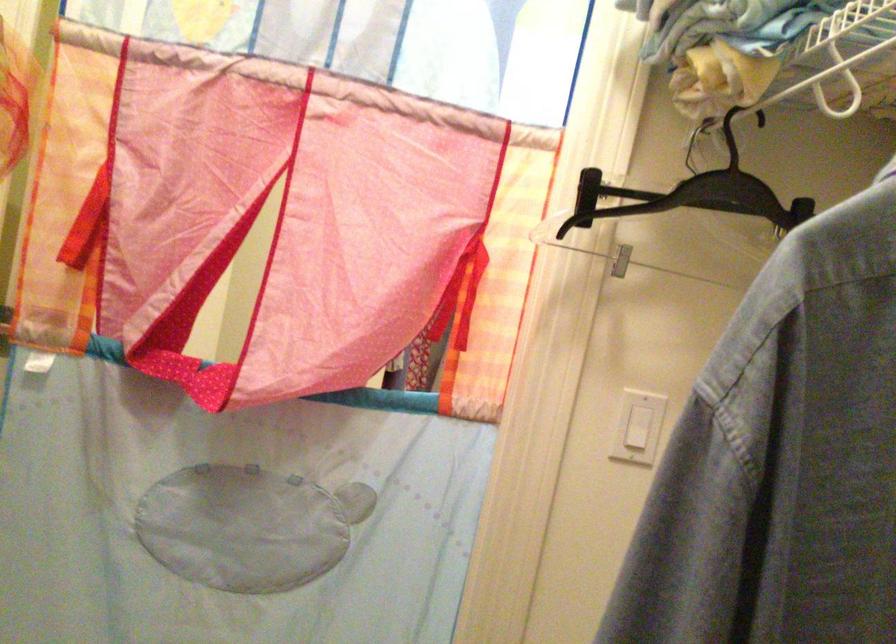
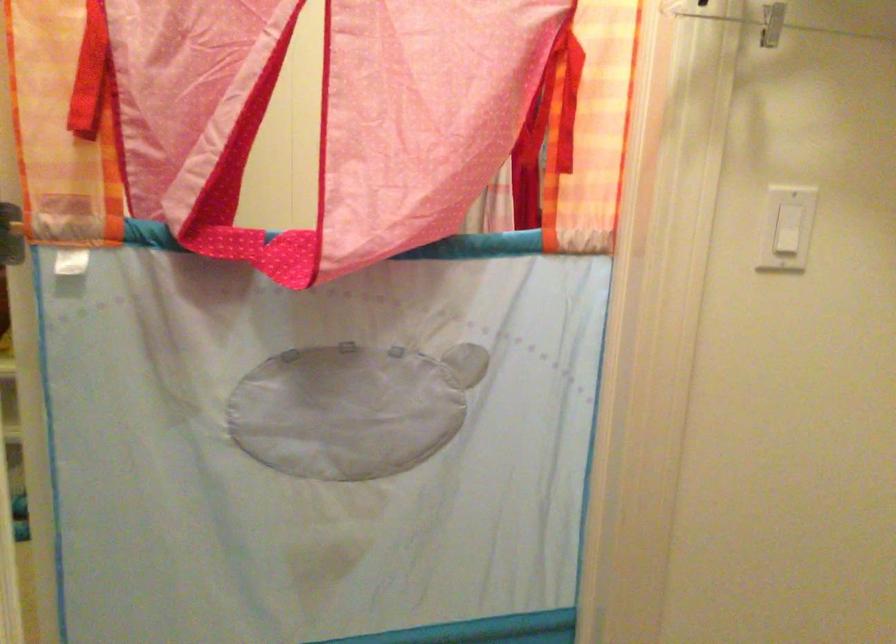
In the second image, find the point that corresponds to pixel 85 218 in the first image.

(90, 73)